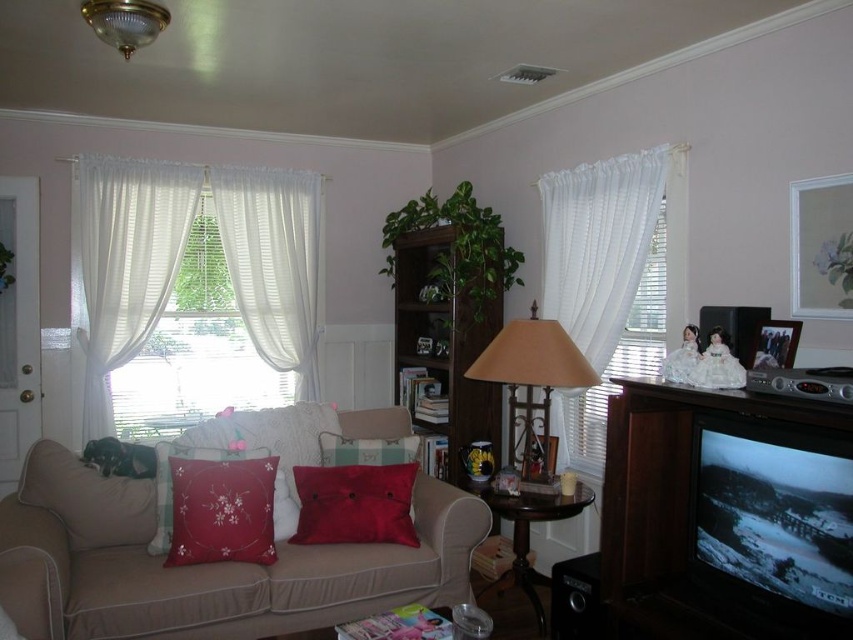
Question: Considering the relative positions of matte beige lampshade at center and wooden photo frame at upper right in the image provided, where is matte beige lampshade at center located with respect to wooden photo frame at upper right?

Choices:
 (A) right
 (B) left

Answer: (B)

Question: Which object is positioned farthest from the matte beige lampshade at center?

Choices:
 (A) sheer white curtains at left
 (B) wooden picture frame at center
 (C) white sheer curtains at right

Answer: (A)

Question: Based on their relative distances, which object is farther from the wooden photo frame at upper right?

Choices:
 (A) matte beige lampshade at center
 (B) gold glass ceiling light at upper center
 (C) red satin pillow at lower left
 (D) silky red pillow at center

Answer: (C)

Question: Does beige fabric couch at center have a smaller size compared to white sheer curtain at left?

Choices:
 (A) yes
 (B) no

Answer: (B)

Question: Is beige fabric couch at center positioned at the back of sheer white curtains at left?

Choices:
 (A) yes
 (B) no

Answer: (B)

Question: Which point is closer to the camera?

Choices:
 (A) (39, 458)
 (B) (367, 488)
 (C) (450, 602)
 (D) (132, 0)

Answer: (D)